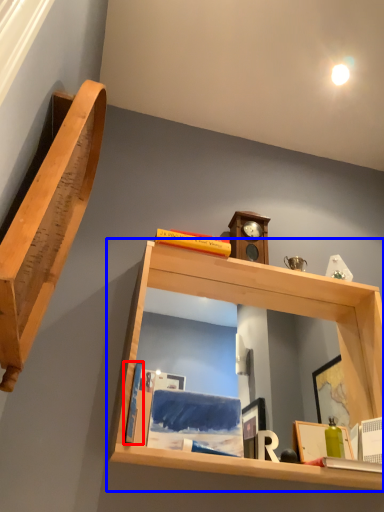
Question: Among these objects, which one is nearest to the camera, book (highlighted by a red box) or shelf (highlighted by a blue box)?

Choices:
 (A) book
 (B) shelf

Answer: (B)